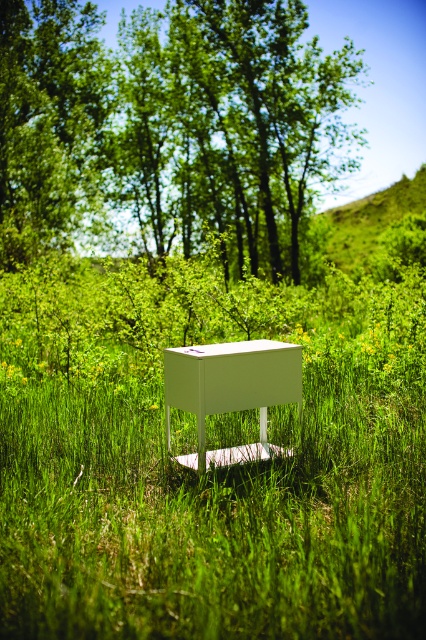
Based on the photo, is green leafy trees at upper center below green leafy tree at upper center?

Yes, green leafy trees at upper center is below green leafy tree at upper center.

Is green leafy trees at upper center behind green leafy tree at upper center?

No.

Is point (192, 108) positioned in front of point (29, 205)?

No.

Find the location of a particular element. The height and width of the screenshot is (640, 426). green leafy trees at upper center is located at coordinates (167, 128).

Who is positioned more to the left, green leafy tree at upper center or white matte table at center?

Positioned to the left is green leafy tree at upper center.

Is green leafy tree at upper center below white matte table at center?

Incorrect, green leafy tree at upper center is not positioned below white matte table at center.

In order to click on green leafy tree at upper center in this screenshot , I will do `click(51, 125)`.

This screenshot has height=640, width=426. Identify the location of green leafy tree at upper center. (51, 125).

Is green leafy trees at upper center above white matte table at center?

Correct, green leafy trees at upper center is located above white matte table at center.

Which of these two, green leafy trees at upper center or white matte table at center, stands taller?

With more height is green leafy trees at upper center.

Is point (253, 173) positioned after point (166, 385)?

Yes.

This screenshot has height=640, width=426. I want to click on green leafy trees at upper center, so click(x=167, y=128).